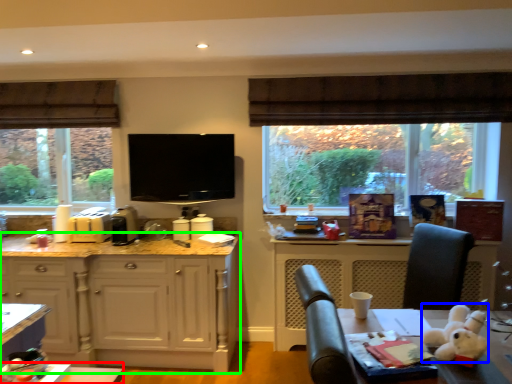
Question: Which object is positioned closest to table (highlighted by a red box)? Select from animal (highlighted by a blue box) and cabinetry (highlighted by a green box).

Choices:
 (A) animal
 (B) cabinetry

Answer: (B)